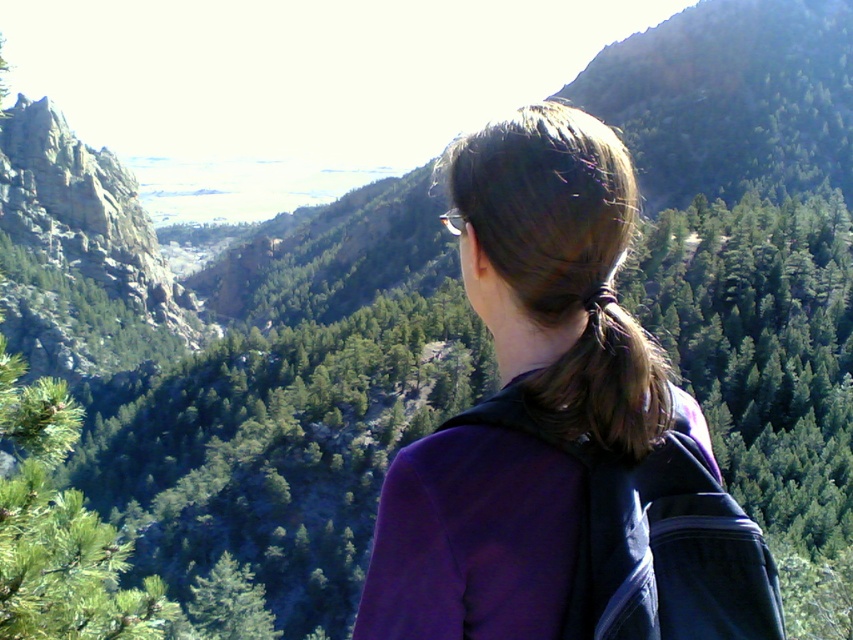
Question: Which point is farther from the camera taking this photo?

Choices:
 (A) (727, 556)
 (B) (576, 404)

Answer: (B)

Question: Can you confirm if purple fabric at center is positioned to the left of brown shiny hair at center?

Choices:
 (A) yes
 (B) no

Answer: (A)

Question: Which point appears closest to the camera in this image?

Choices:
 (A) (625, 460)
 (B) (625, 424)

Answer: (B)

Question: Is purple fabric at center bigger than brown shiny hair at center?

Choices:
 (A) yes
 (B) no

Answer: (A)

Question: Which object is farther from the camera taking this photo?

Choices:
 (A) purple fabric at center
 (B) brown shiny hair at center

Answer: (B)

Question: Can you confirm if purple fabric at center is positioned to the left of brown shiny hair at center?

Choices:
 (A) no
 (B) yes

Answer: (B)